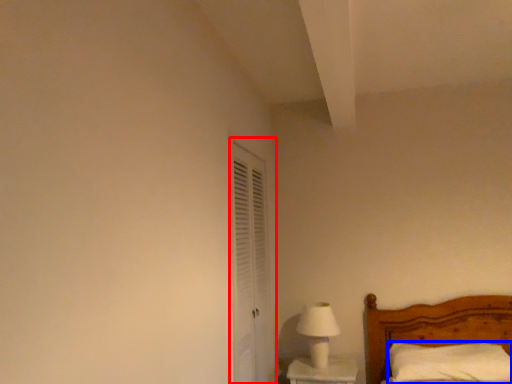
Question: Which point is closer to the camera, screen door (highlighted by a red box) or pillow (highlighted by a blue box)?

Choices:
 (A) screen door
 (B) pillow

Answer: (A)